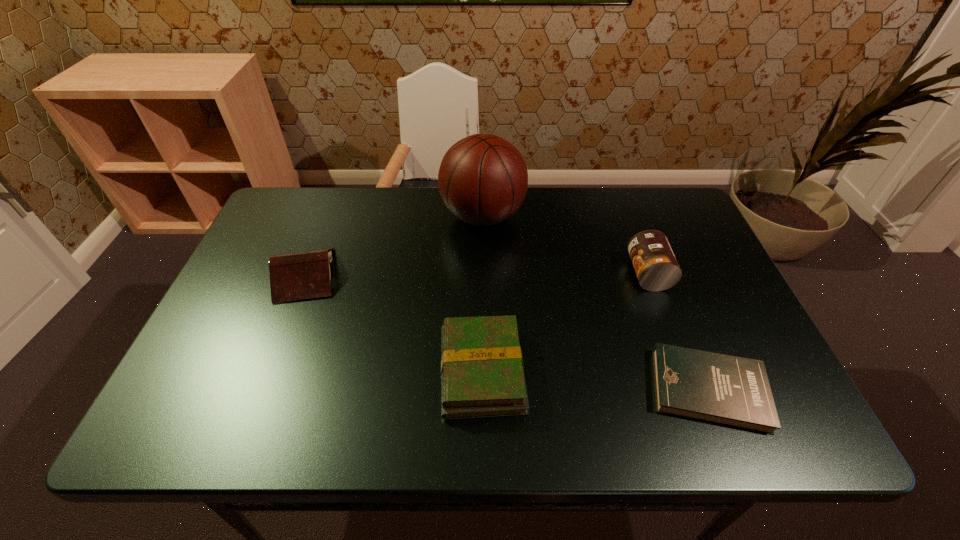
At what (x,y) coordinates should I click in order to perform the action: click on free space located 0.080m on the front label of the fourth shortest object. Please return your answer as a coordinate pair (x, y). This screenshot has height=540, width=960. Looking at the image, I should click on (599, 274).

Where is `free space located 0.060m on the front label of the fourth shortest object`? This screenshot has width=960, height=540. free space located 0.060m on the front label of the fourth shortest object is located at coordinates (607, 274).

Image resolution: width=960 pixels, height=540 pixels. What are the coordinates of `free space located 0.300m on the right of the farthest book` in the screenshot? It's located at (453, 275).

You are a GUI agent. You are given a task and a screenshot of the screen. Output one action in this format:
    pyautogui.click(x=<x>, y=<y>)
    Task: Click on the vacant space situated 0.140m on the left of the second book from right to left
    Image resolution: width=960 pixels, height=540 pixels.
    Given the screenshot: What is the action you would take?
    pyautogui.click(x=374, y=370)

Where is `free region located 0.050m on the back of the rightmost book`? The image size is (960, 540). free region located 0.050m on the back of the rightmost book is located at coordinates (685, 333).

Where is `object at the far edge`? The height and width of the screenshot is (540, 960). object at the far edge is located at coordinates (483, 179).

Identify the location of object that is at the left edge. (303, 275).

The height and width of the screenshot is (540, 960). I want to click on can at the right edge, so click(x=656, y=267).

At what (x,y) coordinates should I click in order to perform the action: click on book positioned at the right edge. Please return your answer as a coordinate pair (x, y). This screenshot has height=540, width=960. Looking at the image, I should click on (733, 391).

Image resolution: width=960 pixels, height=540 pixels. What are the coordinates of `object that is at the near right corner` in the screenshot? It's located at point(733,391).